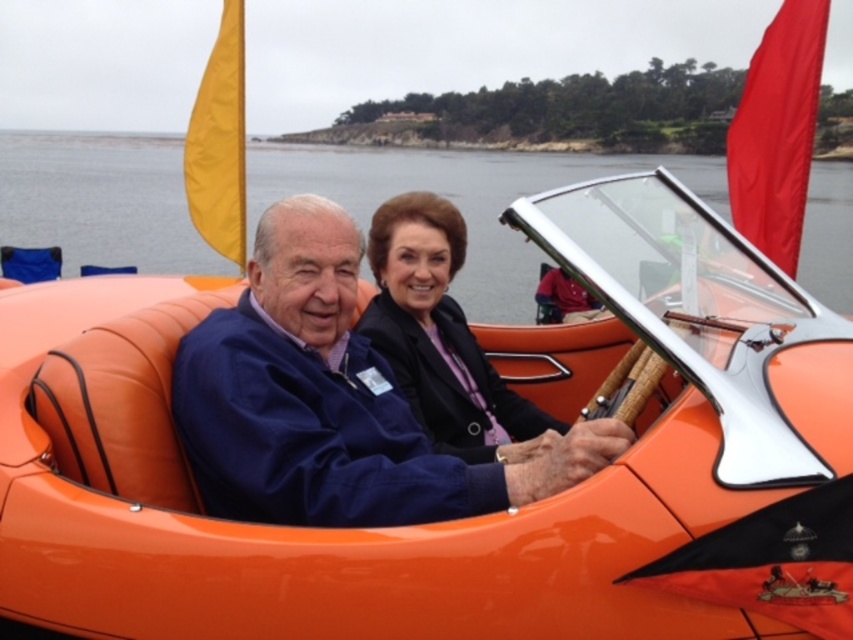
Is orange leather water at center wider than matte black jacket at center?

Yes, orange leather water at center is wider than matte black jacket at center.

Is orange leather water at center bigger than matte black jacket at center?

Yes, orange leather water at center is bigger than matte black jacket at center.

This screenshot has width=853, height=640. Describe the element at coordinates (461, 200) in the screenshot. I see `orange leather water at center` at that location.

This screenshot has height=640, width=853. Identify the location of orange leather water at center. (461, 200).

Between matte blue jacket at center and matte black jacket at center, which one is positioned higher?

matte black jacket at center is above.

Can you confirm if matte blue jacket at center is taller than matte black jacket at center?

No, matte blue jacket at center is not taller than matte black jacket at center.

Is point (215, 412) positioned before point (456, 316)?

Yes.

Where is `matte blue jacket at center`? The width and height of the screenshot is (853, 640). matte blue jacket at center is located at coordinates (332, 403).

Is matte blue jacket at center thinner than orange leather water at center?

Yes.

Is point (292, 403) positioned after point (846, 289)?

No, it is not.

Describe the element at coordinates (332, 403) in the screenshot. I see `matte blue jacket at center` at that location.

Find the location of a particular element. This screenshot has height=640, width=853. matte blue jacket at center is located at coordinates (332, 403).